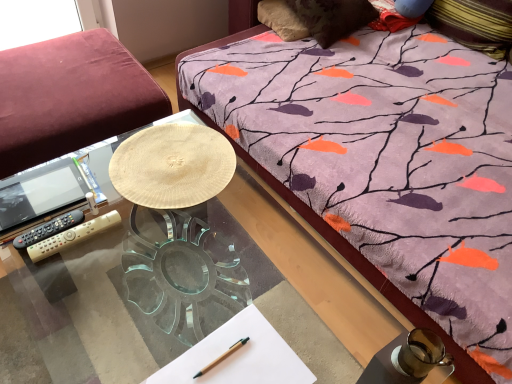
The height and width of the screenshot is (384, 512). In order to click on free location to the right of wooden pen at lower center in this screenshot , I will do `click(265, 359)`.